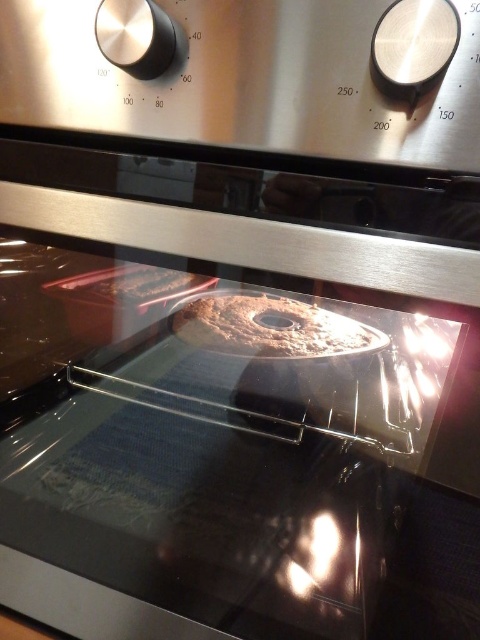
Does golden brown doughnut at center lie in front of matte brown tray at left?

Yes, it is in front of matte brown tray at left.

Which is in front, point (205, 336) or point (124, 280)?

Point (205, 336) is more forward.

Is point (225, 314) less distant than point (187, 282)?

Yes, it is in front of point (187, 282).

Locate an element on the screen. This screenshot has height=640, width=480. golden brown doughnut at center is located at coordinates (271, 326).

Is brushed metal oven knobs at upper center bigger than golden brown doughnut at center?

Actually, brushed metal oven knobs at upper center might be smaller than golden brown doughnut at center.

Does brushed metal oven knobs at upper center appear on the right side of golden brown doughnut at center?

Incorrect, brushed metal oven knobs at upper center is not on the right side of golden brown doughnut at center.

Is point (178, 77) closer to viewer compared to point (242, 330)?

That is True.

Where is `brushed metal oven knobs at upper center`? This screenshot has width=480, height=640. brushed metal oven knobs at upper center is located at coordinates (242, 81).

Measure the distance from brushed metal oven knobs at upper center to matte brown tray at left.

brushed metal oven knobs at upper center and matte brown tray at left are 23.74 inches apart from each other.

Between point (363, 54) and point (156, 266), which one is positioned in front?

Positioned in front is point (363, 54).

Is point (407, 116) in front of point (192, 275)?

That is True.

The image size is (480, 640). I want to click on brushed metal oven knobs at upper center, so click(242, 81).